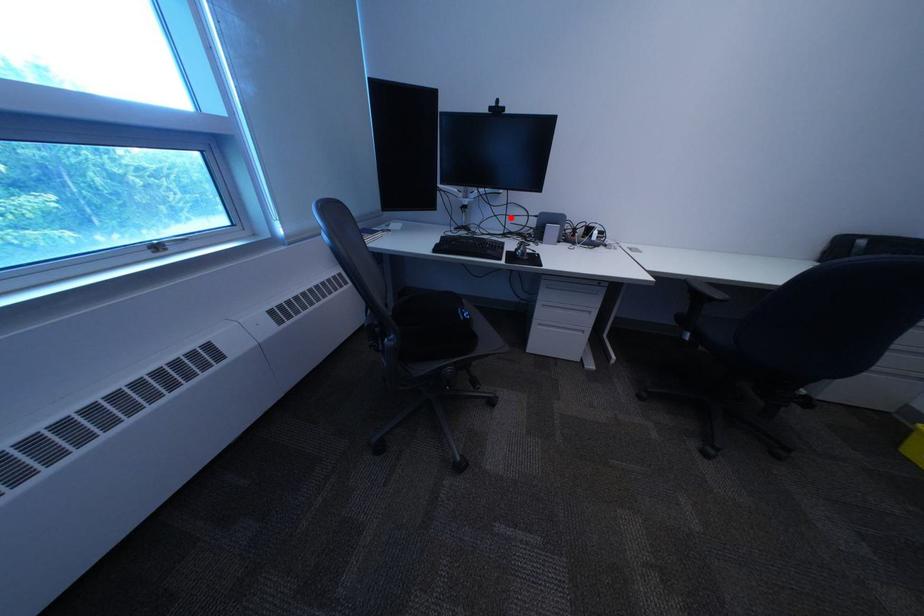
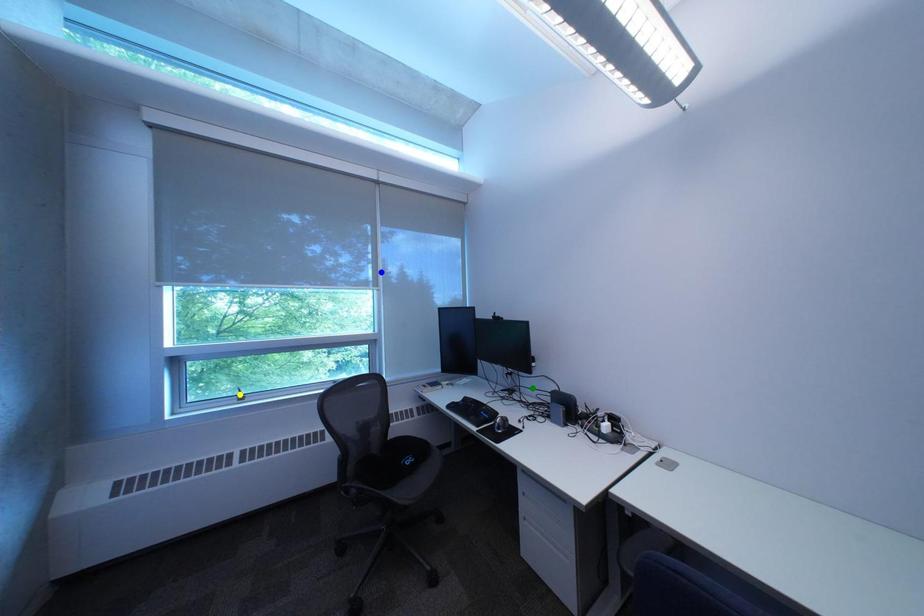
Question: I am providing you with two images of the same scene from different viewpoints. A red point is marked on the first image. You are given multiple points on the second image. Which mark in image 2 goes with the point in image 1?

Choices:
 (A) blue point
 (B) yellow point
 (C) green point

Answer: (C)